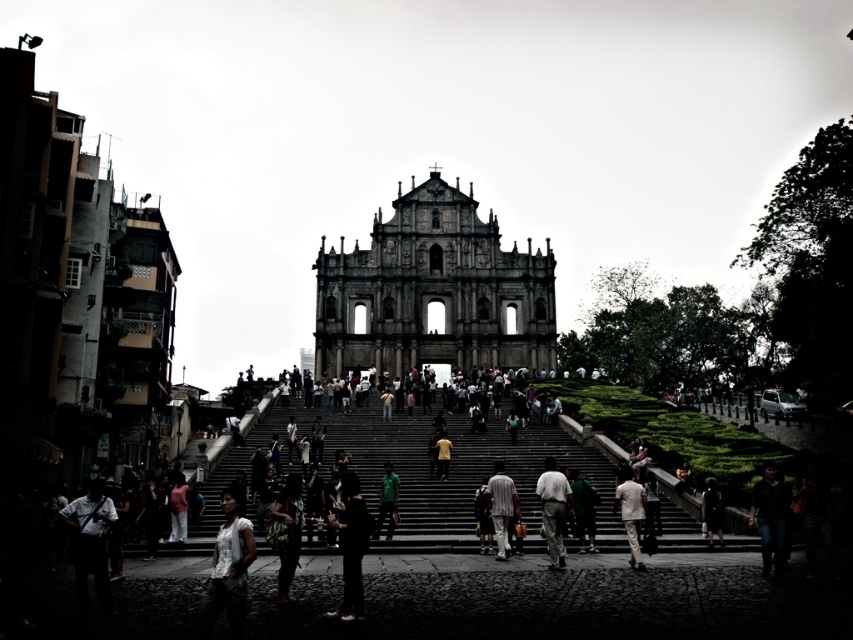
Is dark gray concrete stairs at center above dark green fabric jacket at lower right?

Yes.

Does point (399, 410) come closer to viewer compared to point (715, 520)?

No, it is behind (715, 520).

Between point (480, 403) and point (720, 513), which one is positioned behind?

The point (480, 403) is behind.

The height and width of the screenshot is (640, 853). In order to click on dark gray concrete stairs at center in this screenshot , I will do `click(488, 397)`.

Is white fabric shirt at lower center shorter than light beige fabric pants at center?

In fact, white fabric shirt at lower center may be taller than light beige fabric pants at center.

Does white fabric shirt at lower center have a smaller size compared to light beige fabric pants at center?

Actually, white fabric shirt at lower center might be larger than light beige fabric pants at center.

Image resolution: width=853 pixels, height=640 pixels. In order to click on white fabric shirt at lower center in this screenshot , I will do `click(227, 570)`.

Is black fabric pants at center positioned at the back of dark brown leather jacket at lower right?

No, black fabric pants at center is closer to the viewer.

Does black fabric pants at center appear over dark brown leather jacket at lower right?

Actually, black fabric pants at center is below dark brown leather jacket at lower right.

Describe the element at coordinates (350, 547) in the screenshot. This screenshot has height=640, width=853. I see `black fabric pants at center` at that location.

Where is `black fabric pants at center`? Image resolution: width=853 pixels, height=640 pixels. black fabric pants at center is located at coordinates (350, 547).